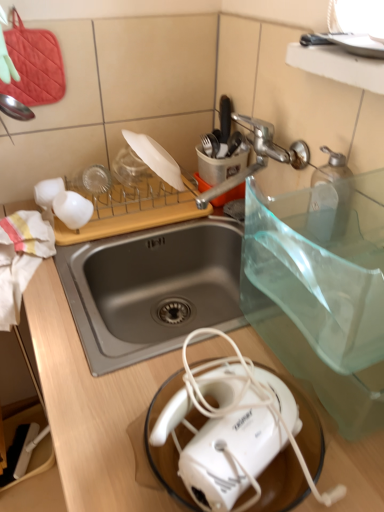
At what (x,y) coordinates should I click in order to perform the action: click on vacant space behind white plastic toaster at lower center. Please return your answer as a coordinate pair (x, y). This screenshot has height=512, width=384. Looking at the image, I should click on (182, 356).